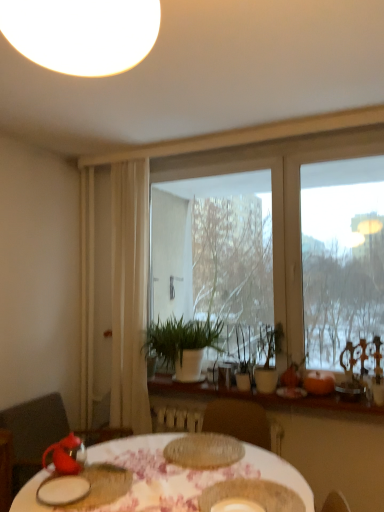
Find the location of a particular element. The width and height of the screenshot is (384, 512). free location above translucent glass plate at center, which is the fourth tableware from left to right (from a real-world perspective) is located at coordinates (205, 446).